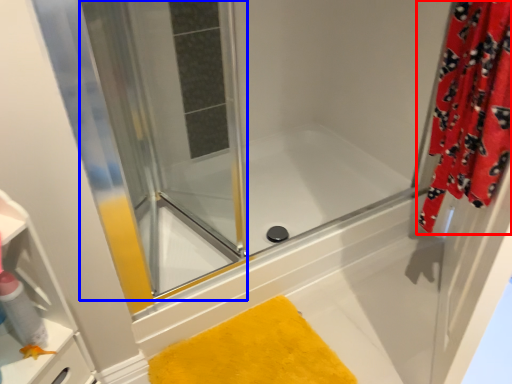
Question: Among these objects, which one is nearest to the camera, curtain (highlighted by a red box) or screen door (highlighted by a blue box)?

Choices:
 (A) curtain
 (B) screen door

Answer: (A)